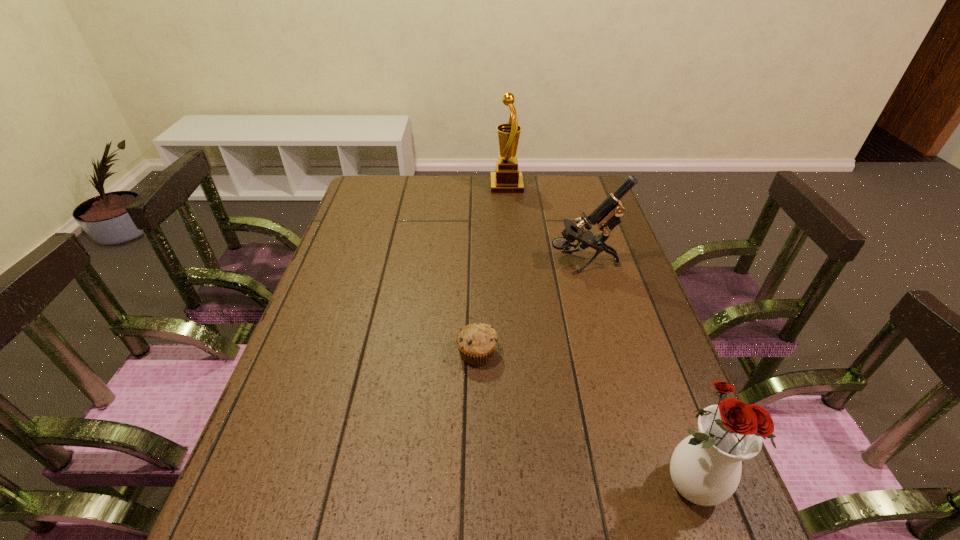
Locate an element on the screen. This screenshot has width=960, height=540. free space between the muffin and the nearest object is located at coordinates (583, 419).

Locate an element on the screen. Image resolution: width=960 pixels, height=540 pixels. free space between the farthest object and the nearest object is located at coordinates (597, 336).

Identify which object is located as the third nearest to the second farthest object. Please provide its 2D coordinates. Your answer should be formatted as a tuple, i.e. [(x, y)], where the tuple contains the x and y coordinates of a point satisfying the conditions above.

[(705, 467)]

I want to click on object that is the third closest to the farthest object, so click(x=705, y=467).

Locate an element on the screen. This screenshot has width=960, height=540. free space that satisfies the following two spatial constraints: 1. through the eyepiece of the vase; 2. on the right side of the second farthest object is located at coordinates (645, 485).

Find the location of a particular element. The height and width of the screenshot is (540, 960). free space that satisfies the following two spatial constraints: 1. through the eyepiece of the second farthest object; 2. on the right side of the nearest object is located at coordinates (645, 485).

What are the coordinates of `vacant space that satisfies the following two spatial constraints: 1. through the eyepiece of the microscope; 2. on the left side of the nearest object` in the screenshot? It's located at (645, 485).

Find the location of a particular element. The image size is (960, 540). free location that satisfies the following two spatial constraints: 1. on the front side of the second nearest object; 2. on the right side of the nearest object is located at coordinates (476, 485).

At what (x,y) coordinates should I click in order to perform the action: click on free region that satisfies the following two spatial constraints: 1. through the eyepiece of the microscope; 2. on the left side of the nearest object. Please return your answer as a coordinate pair (x, y). This screenshot has width=960, height=540. Looking at the image, I should click on (645, 485).

Find the location of a particular element. This screenshot has width=960, height=540. free space that satisfies the following two spatial constraints: 1. on the front-facing side of the nearest object; 2. on the right side of the tallest object is located at coordinates (534, 485).